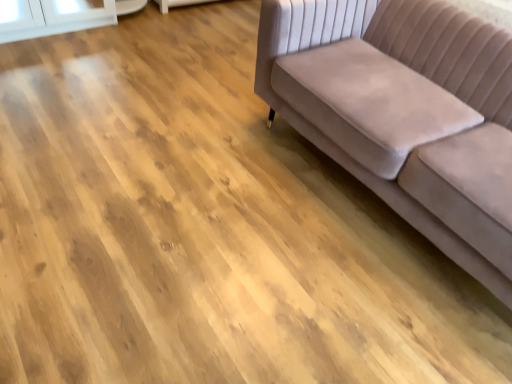
The image size is (512, 384). Identify the location of vacant space situated on the left part of velvet beige couch at right. (180, 203).